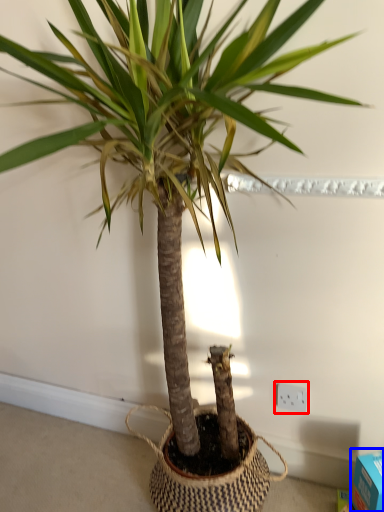
Question: Which object appears farthest to the camera in this image, electric outlet (highlighted by a red box) or box (highlighted by a blue box)?

Choices:
 (A) electric outlet
 (B) box

Answer: (A)